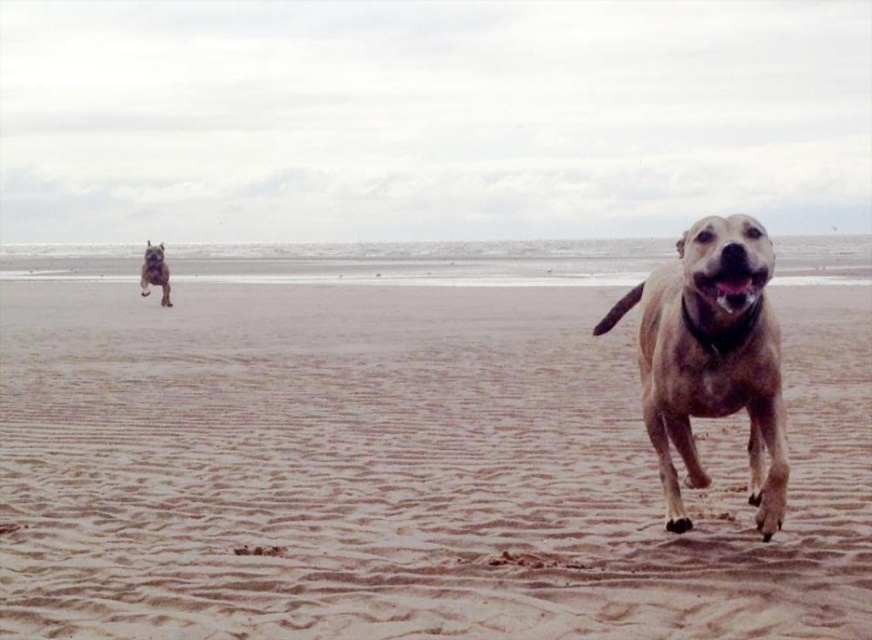
Question: Which point is farther to the camera?

Choices:
 (A) [x=672, y=410]
 (B) [x=573, y=561]

Answer: (B)

Question: Considering the relative positions of golden-brown fur dog at right and shiny brown fur at upper left in the image provided, where is golden-brown fur dog at right located with respect to shiny brown fur at upper left?

Choices:
 (A) below
 (B) above

Answer: (A)

Question: In this image, where is golden-brown fur dog at right located relative to shiny brown fur at upper left?

Choices:
 (A) right
 (B) left

Answer: (A)

Question: Which point is closer to the camera taking this photo?

Choices:
 (A) (733, 282)
 (B) (583, 598)

Answer: (A)

Question: In this image, where is brown sandy beach at center located relative to shiny brown fur at upper left?

Choices:
 (A) left
 (B) right

Answer: (B)

Question: Based on their relative distances, which object is farther from the brown sandy beach at center?

Choices:
 (A) golden-brown fur dog at right
 (B) shiny brown fur at upper left

Answer: (B)